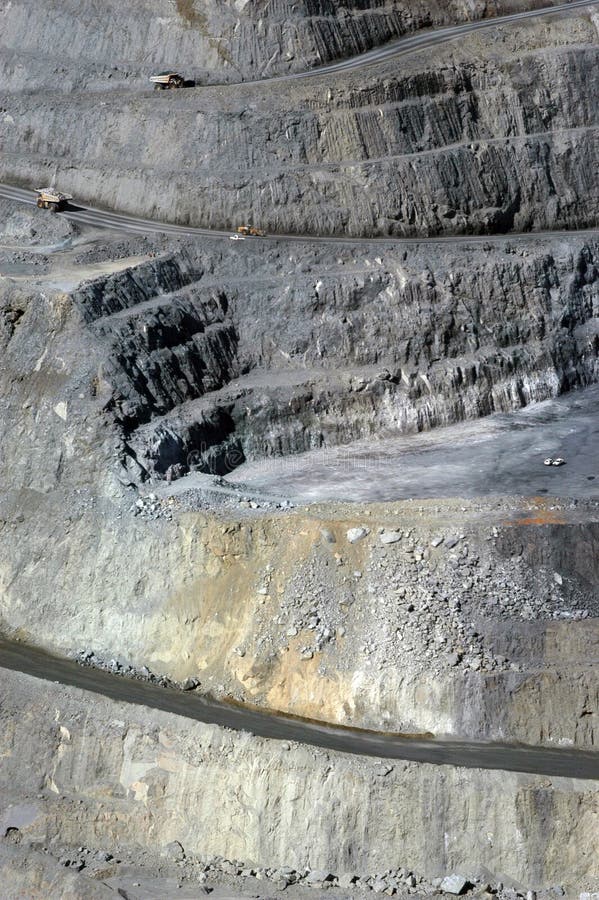
Locate an element on the screen. yellowish brown areas on side wall is located at coordinates (302, 693), (208, 648), (263, 535).